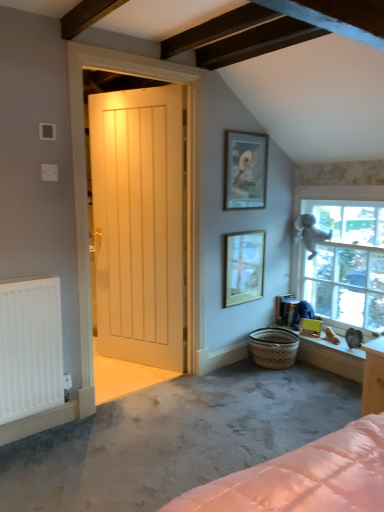
At what (x,y) coordinates should I click in order to perform the action: click on vacant space in front of woven natural basket at lower right. Please return your answer as a coordinate pair (x, y). The height and width of the screenshot is (512, 384). Looking at the image, I should click on (282, 383).